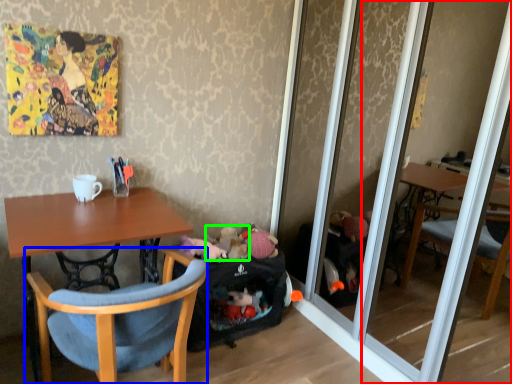
Question: Considering the real-world distances, which object is farthest from mirror (highlighted by a red box)? chair (highlighted by a blue box) or toy (highlighted by a green box)?

Choices:
 (A) chair
 (B) toy

Answer: (A)